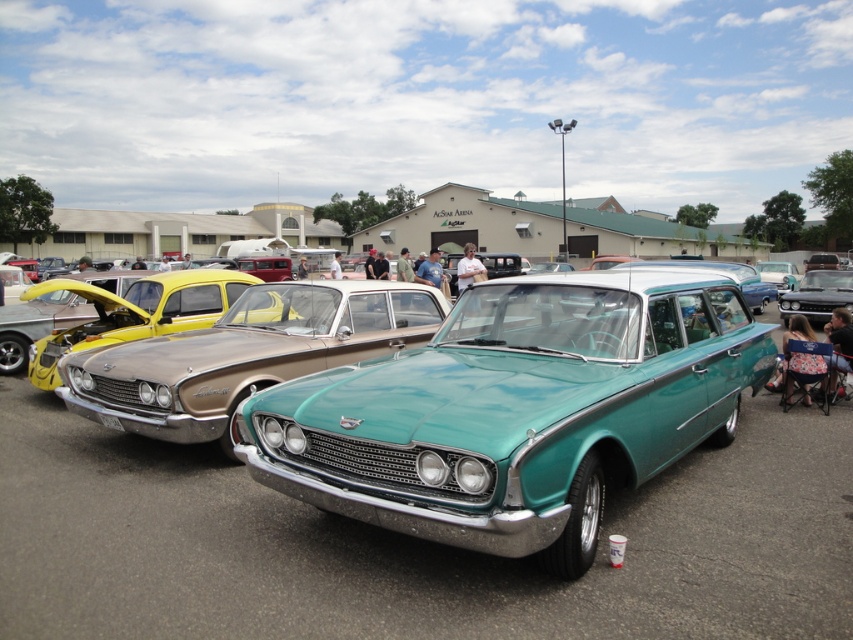
You are a photographer positioned at the front of the teal glossy car at center and the shiny black car at center. You want to capture a photo that includes both cars in the frame. Based on their positions, which car should you focus on first to ensure both are in the shot?

The teal glossy car at center is located below the shiny black car at center, so you should focus on the shiny black car at center first to ensure both are in the shot.

You are a photographer standing in front of the teal glossy car at center and the shiny black car at center. You want to take a photo of both cars without any obstruction. Since you can move around freely, which direction should you move to ensure both cars are fully visible in your shot?

The teal glossy car at center is in front of the shiny black car at center. To ensure both cars are fully visible, you should move to the side so that the teal glossy car at center no longer blocks the view of the shiny black car at center.